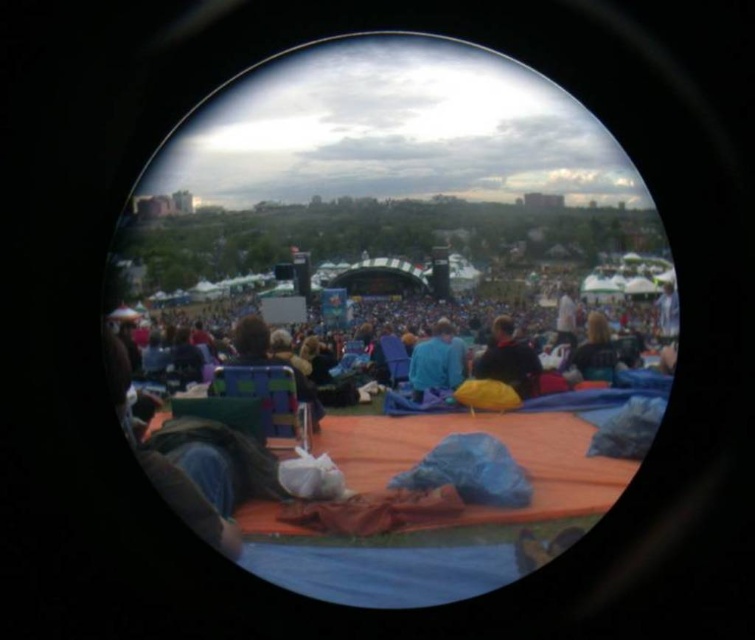
Is dark brown leather jacket at center above blue fabric at center?

No.

Is point (522, 364) closer to viewer compared to point (427, 349)?

That is False.

The image size is (755, 640). I want to click on dark brown leather jacket at center, so click(507, 360).

Locate an element on the screen. The height and width of the screenshot is (640, 755). dark brown leather jacket at center is located at coordinates (507, 360).

Is dark brown leather jacket at center wider than dark blue fabric at center?

Correct, the width of dark brown leather jacket at center exceeds that of dark blue fabric at center.

Where is `dark brown leather jacket at center`? dark brown leather jacket at center is located at coordinates (507, 360).

The width and height of the screenshot is (755, 640). What do you see at coordinates (507, 360) in the screenshot?
I see `dark brown leather jacket at center` at bounding box center [507, 360].

At what (x,y) coordinates should I click in order to perform the action: click on dark brown leather jacket at center. Please return your answer as a coordinate pair (x, y). The width and height of the screenshot is (755, 640). Looking at the image, I should click on (507, 360).

Is blue fabric chairs at center closer to the viewer compared to dark brown leather jacket at center?

Yes, it is in front of dark brown leather jacket at center.

Does blue fabric chairs at center have a lesser height compared to dark brown leather jacket at center?

Incorrect, blue fabric chairs at center's height does not fall short of dark brown leather jacket at center's.

Who is more forward, (408, 400) or (535, 392)?

Point (535, 392)

You are a GUI agent. You are given a task and a screenshot of the screen. Output one action in this format:
    pyautogui.click(x=<x>, y=<y>)
    Task: Click on the blue fabric chairs at center
    This screenshot has width=755, height=640.
    Given the screenshot: What is the action you would take?
    coord(599,355)